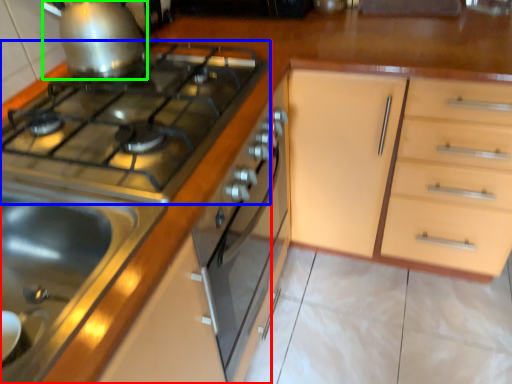
Question: Based on their relative distances, which object is farther from kitchen appliance (highlighted by a red box)? Choose from gas stove (highlighted by a blue box) and kitchen appliance (highlighted by a green box).

Choices:
 (A) gas stove
 (B) kitchen appliance

Answer: (B)